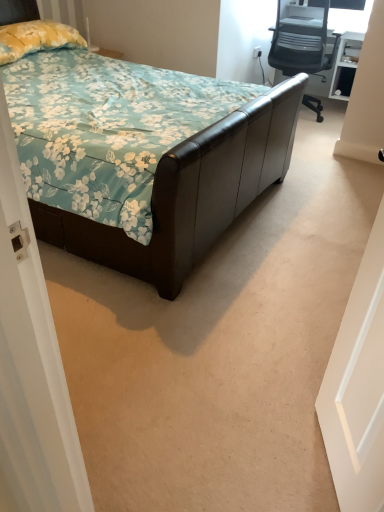
Where is `vacant region to the left of white matte door at right`? The width and height of the screenshot is (384, 512). vacant region to the left of white matte door at right is located at coordinates (246, 451).